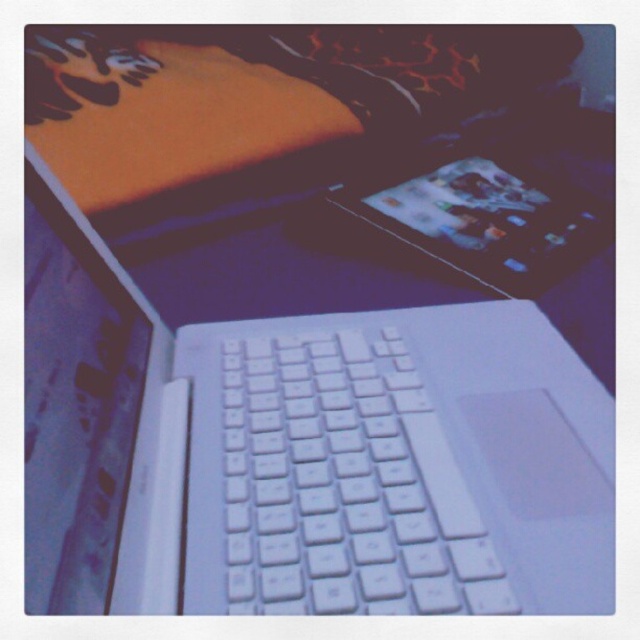
Consider the image. Who is more distant from viewer, (422, 540) or (509, 198)?

The point (509, 198) is behind.

Does white matte laptop at center have a larger size compared to metallic silver tablet at center?

Correct, white matte laptop at center is larger in size than metallic silver tablet at center.

I want to click on white matte laptop at center, so click(300, 451).

Identify the location of white matte laptop at center. This screenshot has height=640, width=640. (300, 451).

Can you confirm if white plastic keyboard at center is positioned above metallic silver tablet at center?

Actually, white plastic keyboard at center is below metallic silver tablet at center.

Does point (440, 561) come farther from viewer compared to point (442, 177)?

No, (440, 561) is closer to viewer.

Where is `white plastic keyboard at center`? This screenshot has width=640, height=640. white plastic keyboard at center is located at coordinates (344, 483).

Is point (202, 328) positioned behind point (276, 440)?

Yes, it is behind point (276, 440).

Which is above, white matte laptop at center or white plastic keyboard at center?

white matte laptop at center is higher up.

In order to click on white matte laptop at center in this screenshot , I will do `click(300, 451)`.

Where is `white matte laptop at center`? This screenshot has height=640, width=640. white matte laptop at center is located at coordinates (300, 451).